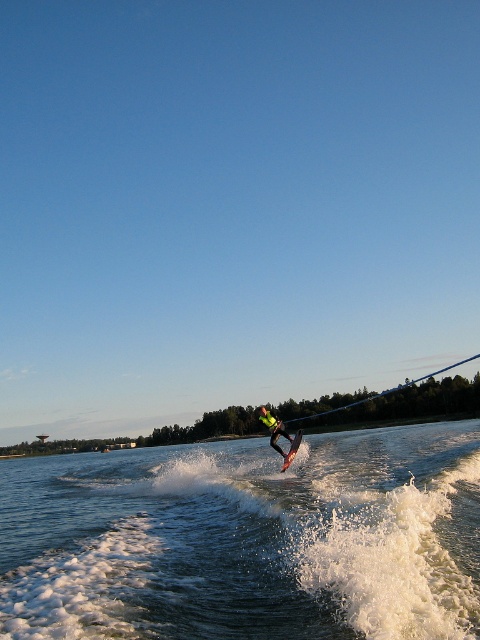
Question: Which object is farther from the camera taking this photo?

Choices:
 (A) yellow-green fabric at center
 (B) shiny metallic water ski at center

Answer: (A)

Question: Can you confirm if yellow-green fabric at center is bigger than shiny metallic water ski at center?

Choices:
 (A) yes
 (B) no

Answer: (A)

Question: Which of the following is the farthest from the observer?

Choices:
 (A) shiny metallic water ski at center
 (B) translucent water at center
 (C) yellow-green fabric at center

Answer: (C)

Question: Among these objects, which one is nearest to the camera?

Choices:
 (A) shiny metallic water ski at center
 (B) yellow-green fabric at center

Answer: (A)

Question: Can you confirm if translucent water at center is wider than yellow-green fabric at center?

Choices:
 (A) no
 (B) yes

Answer: (B)

Question: From the image, what is the correct spatial relationship of translucent water at center in relation to shiny metallic water ski at center?

Choices:
 (A) right
 (B) left

Answer: (B)